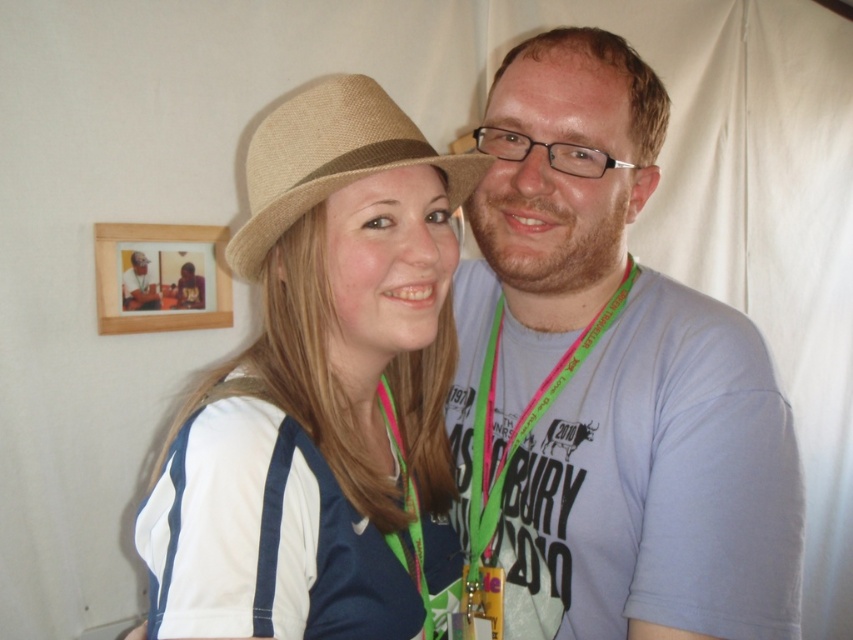
Question: Which object appears farthest from the camera in this image?

Choices:
 (A) matte black hat at upper left
 (B) burlap beige hat at upper left

Answer: (A)

Question: Estimate the real-world distances between objects in this image. Which object is farther from the matte black hat at upper left?

Choices:
 (A) burlap beige hat at upper left
 (B) beige fabric neck at center
 (C) green fabric lanyard at center
 (D) matte fabric neck at center

Answer: (D)

Question: Can you confirm if burlap beige hat at upper left is positioned above beige fabric neck at center?

Choices:
 (A) yes
 (B) no

Answer: (A)

Question: In this image, where is burlap beige hat at upper left located relative to green fabric lanyard at center?

Choices:
 (A) above
 (B) below

Answer: (A)

Question: Observing the image, what is the correct spatial positioning of wooden picture frame at upper left in reference to green fabric lanyard at center?

Choices:
 (A) below
 (B) above

Answer: (B)

Question: Which of the following is the farthest from the observer?

Choices:
 (A) (412, 582)
 (B) (531, 285)
 (C) (367, 138)
 (D) (137, 291)

Answer: (D)